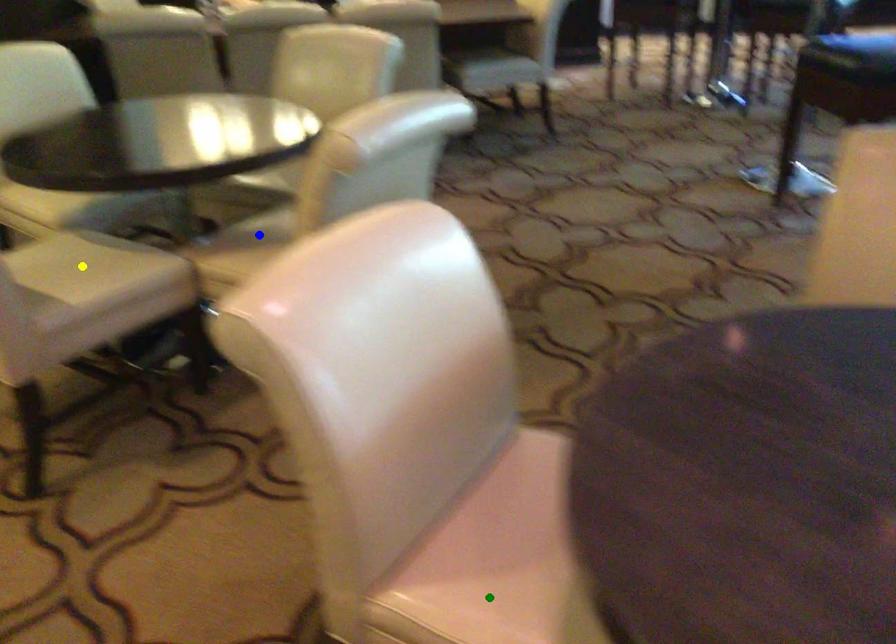
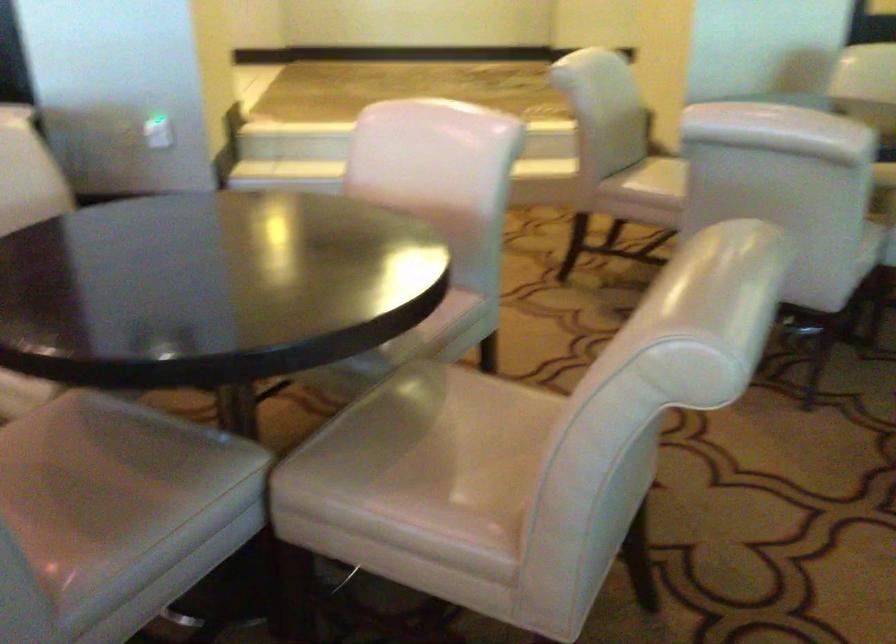
I am providing you with two images of the same scene from different viewpoints. Three points are marked in image1. Which point corresponds to a part or object that is occluded in image2?In image1, three points are marked. Which of them correspond to a part or object that is occluded in image2?Among the three points shown in image1, which one corresponds to a part or object that is no longer visible due to occlusion in image2?

Invisible in image2: blue point, green point, yellow point.